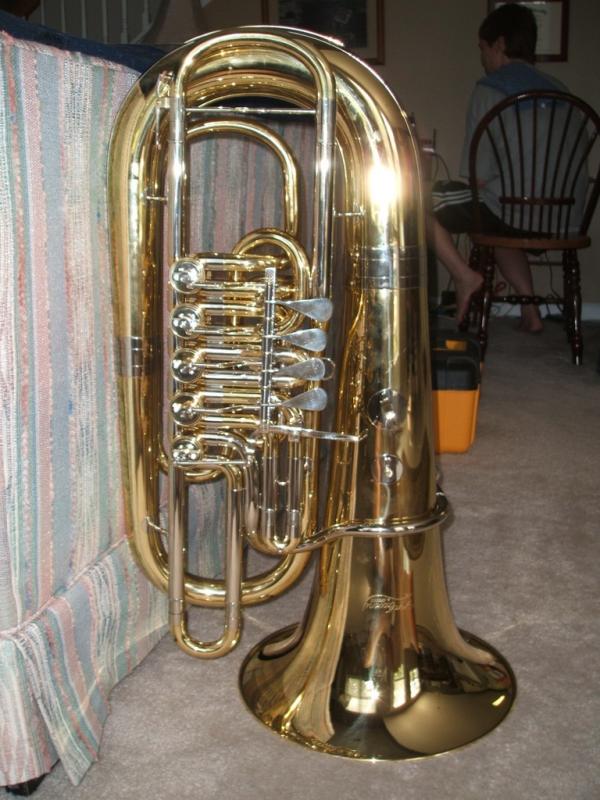
Where is `carpet`? The width and height of the screenshot is (600, 800). carpet is located at coordinates (169, 753).